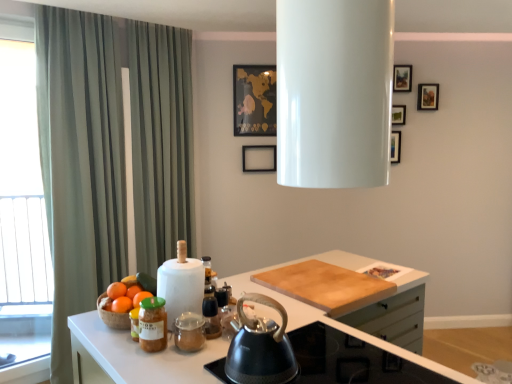
Where is `free point above white glossy countertop at lower left (from a real-world perspective)`? free point above white glossy countertop at lower left (from a real-world perspective) is located at coordinates (295, 283).